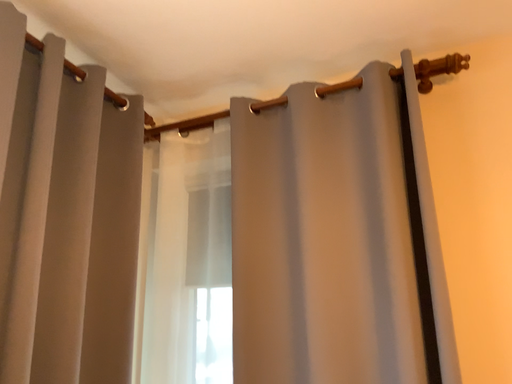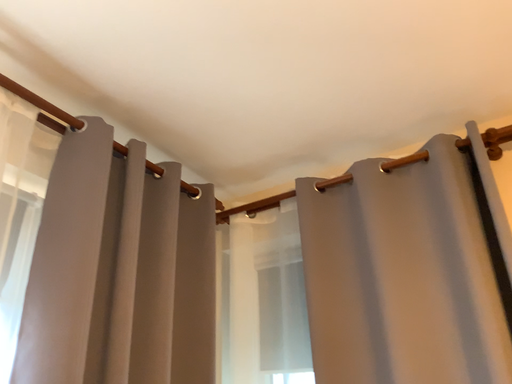
Question: How did the camera likely rotate when shooting the video?

Choices:
 (A) rotated upward
 (B) rotated downward

Answer: (A)